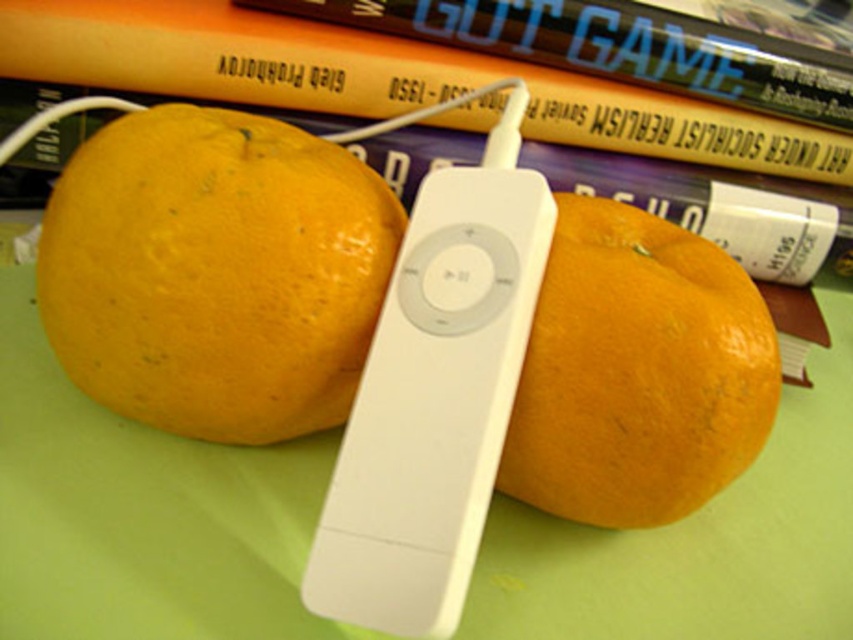
Question: Which is nearer to the glossy orange at center?

Choices:
 (A) green matte table at center
 (B) hardcover book at upper center

Answer: (A)

Question: Based on their relative distances, which object is farther from the white plastic remote at center?

Choices:
 (A) green matte table at center
 (B) yellow matte/orange at center
 (C) hardcover book at upper center

Answer: (C)

Question: Does white plastic remote at center appear under glossy orange at center?

Choices:
 (A) no
 (B) yes

Answer: (B)

Question: Is green matte table at center above glossy orange at center?

Choices:
 (A) no
 (B) yes

Answer: (A)

Question: Which object appears farthest from the camera in this image?

Choices:
 (A) white plastic remote at center
 (B) hardcover book at upper center
 (C) yellow matte/orange at center

Answer: (B)

Question: Is green matte table at center to the left of glossy orange at center from the viewer's perspective?

Choices:
 (A) yes
 (B) no

Answer: (A)